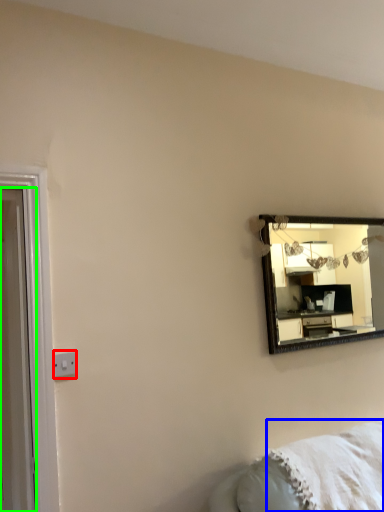
Question: Which object is the closest to the electric outlet (highlighted by a red box)? Choose among these: blanket (highlighted by a blue box) or door (highlighted by a green box).

Choices:
 (A) blanket
 (B) door

Answer: (B)